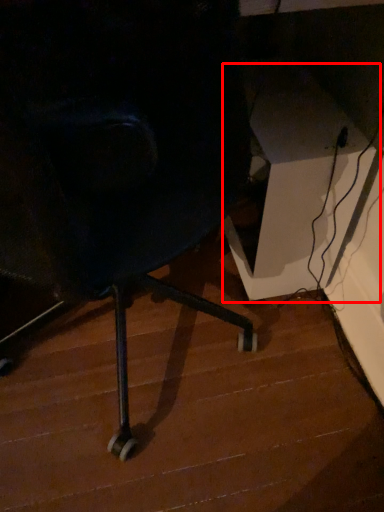
Question: Where is table (annotated by the red box) located in relation to stair in the image?

Choices:
 (A) left
 (B) right

Answer: (B)